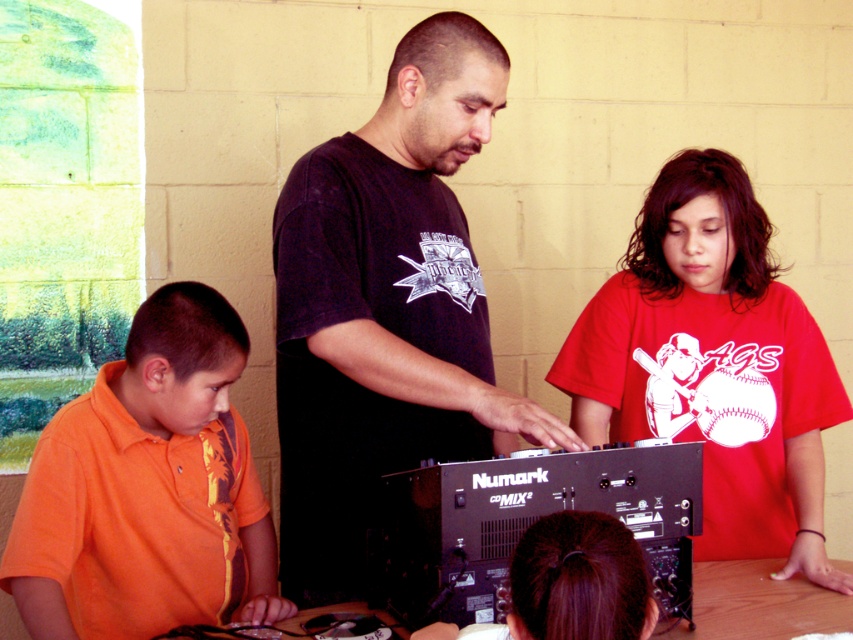
Does black matte shirt at center have a greater height compared to wooden table at center?

Correct, black matte shirt at center is much taller as wooden table at center.

Who is more distant from viewer, (300, 492) or (775, 584)?

Positioned behind is point (775, 584).

You are a GUI agent. You are given a task and a screenshot of the screen. Output one action in this format:
    pyautogui.click(x=<x>, y=<y>)
    Task: Click on the black matte shirt at center
    This screenshot has width=853, height=640.
    Given the screenshot: What is the action you would take?
    pyautogui.click(x=386, y=308)

Who is higher up, red matte shirt at center or orange cotton shirt at lower left?

red matte shirt at center is higher up.

Is red matte shirt at center shorter than orange cotton shirt at lower left?

Incorrect, red matte shirt at center's height does not fall short of orange cotton shirt at lower left's.

Is point (659, 291) behind point (169, 509)?

Yes, it is behind point (169, 509).

Find the location of a particular element. Image resolution: width=853 pixels, height=640 pixels. red matte shirt at center is located at coordinates (712, 365).

Between point (700, 163) and point (793, 632), which one is positioned in front?

Point (793, 632)

This screenshot has height=640, width=853. What do you see at coordinates (712, 365) in the screenshot?
I see `red matte shirt at center` at bounding box center [712, 365].

At what (x,y) coordinates should I click in order to perform the action: click on red matte shirt at center. Please return your answer as a coordinate pair (x, y). Image resolution: width=853 pixels, height=640 pixels. Looking at the image, I should click on (712, 365).